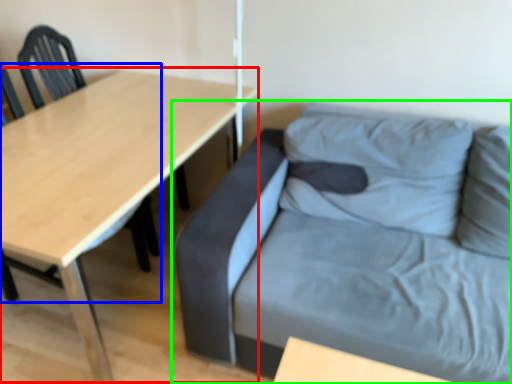
Question: Which object is positioned farthest from table (highlighted by a red box)? Select from chair (highlighted by a blue box) and studio couch (highlighted by a green box).

Choices:
 (A) chair
 (B) studio couch

Answer: (B)